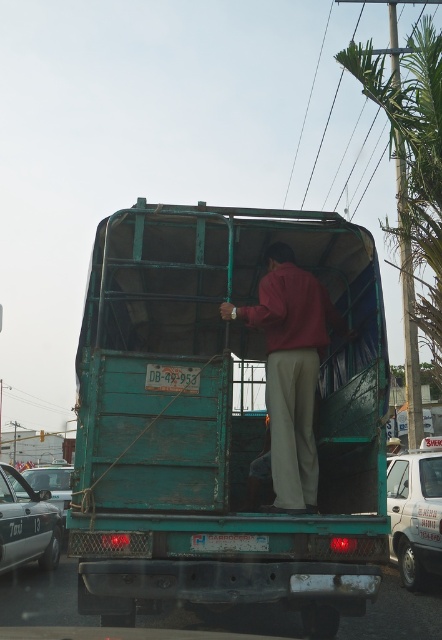
Question: Can you confirm if teal matte truck at center is wider than white glossy van at lower right?

Choices:
 (A) yes
 (B) no

Answer: (A)

Question: Which point is farther to the camera?

Choices:
 (A) teal matte truck at center
 (B) green leafy palm tree at upper right

Answer: (B)

Question: Does maroon fabric shirt at center have a greater width compared to green matte license plate at center?

Choices:
 (A) no
 (B) yes

Answer: (B)

Question: Is the position of maroon fabric shirt at center less distant than that of metallic silver taxi at left?

Choices:
 (A) no
 (B) yes

Answer: (B)

Question: Which object appears farthest from the camera in this image?

Choices:
 (A) teal matte truck at center
 (B) maroon fabric shirt at center
 (C) metallic silver taxi at left
 (D) green leafy palm tree at upper right

Answer: (D)

Question: Based on their relative distances, which object is nearer to the teal matte truck at center?

Choices:
 (A) maroon fabric shirt at center
 (B) green leafy palm tree at upper right
 (C) green matte license plate at center

Answer: (A)